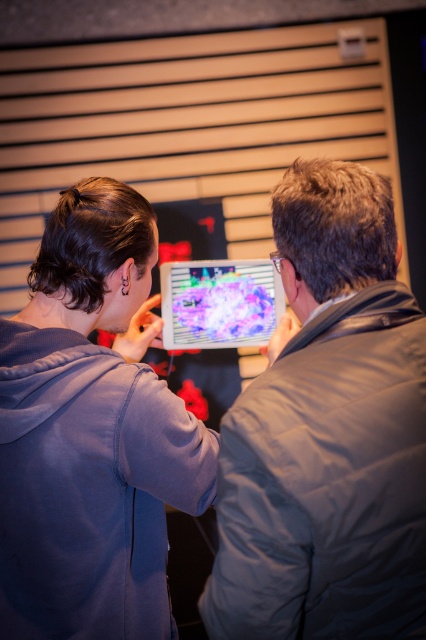
Question: Considering the real-world distances, which object is farthest from the shiny plastic tablet at center?

Choices:
 (A) gray puffy jacket at center
 (B) matte purple hoodie at center

Answer: (A)

Question: Does gray puffy jacket at center have a lesser width compared to shiny plastic tablet at center?

Choices:
 (A) no
 (B) yes

Answer: (B)

Question: Which of these objects is positioned closest to the shiny plastic tablet at center?

Choices:
 (A) gray puffy jacket at center
 (B) matte purple hoodie at center

Answer: (B)

Question: Does gray puffy jacket at center have a lesser width compared to matte purple hoodie at center?

Choices:
 (A) yes
 (B) no

Answer: (A)

Question: Among these points, which one is nearest to the camera?

Choices:
 (A) (68, 497)
 (B) (247, 282)

Answer: (A)

Question: Considering the relative positions of gray puffy jacket at center and shiny plastic tablet at center in the image provided, where is gray puffy jacket at center located with respect to shiny plastic tablet at center?

Choices:
 (A) below
 (B) above

Answer: (A)